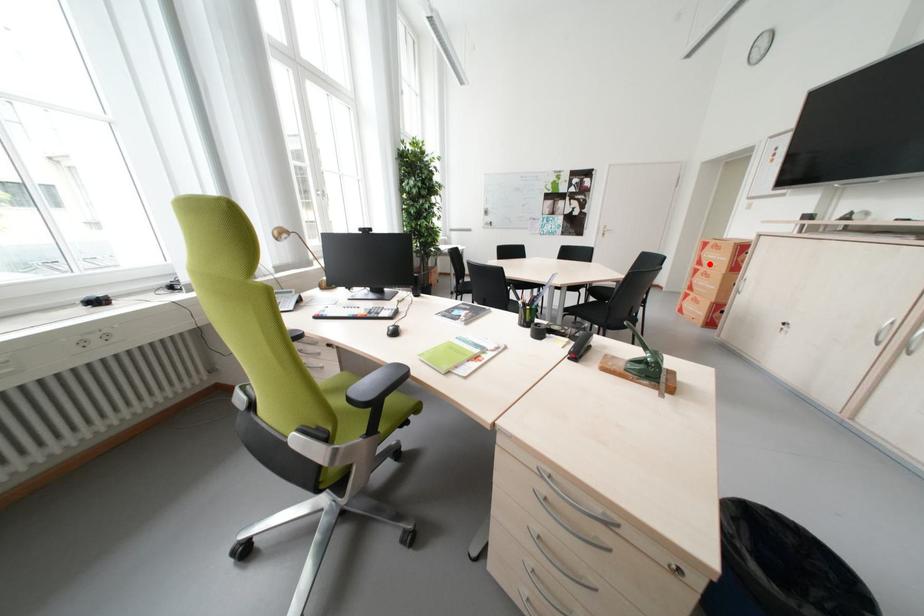
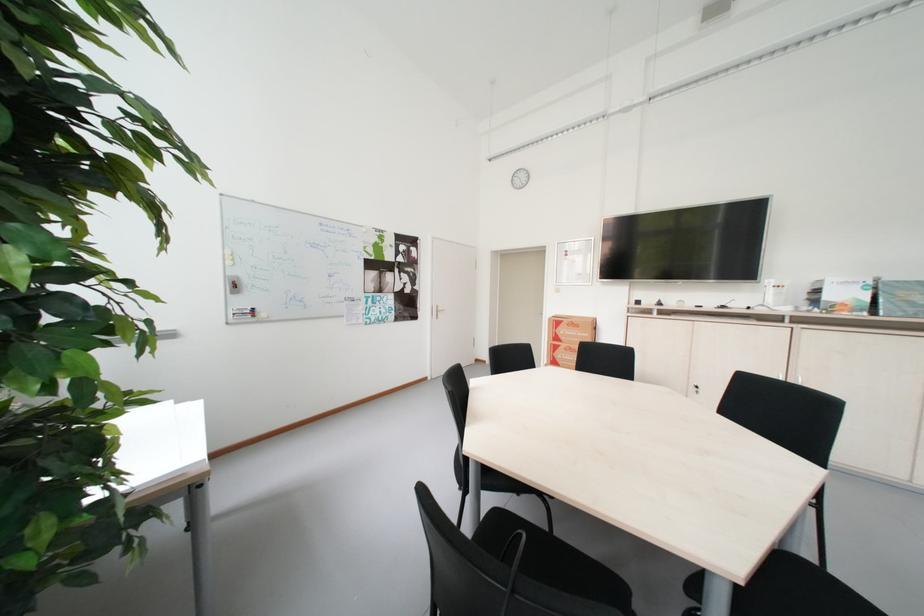
Question: I am providing you with two images of the same scene from different viewpoints. In image1, a red point is highlighted. Considering the same 3D point in image2, which of the following is correct?

Choices:
 (A) It is closer
 (B) It is farther

Answer: (B)